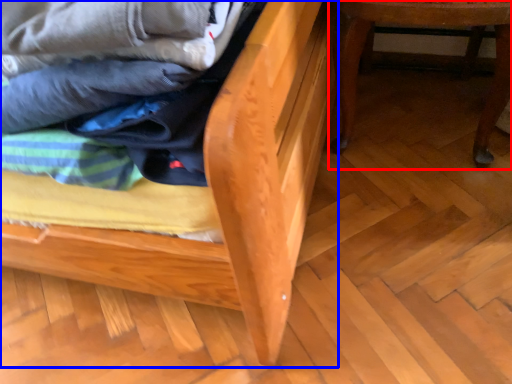
Question: Which object appears closest to the camera in this image, furniture (highlighted by a red box) or furniture (highlighted by a blue box)?

Choices:
 (A) furniture
 (B) furniture

Answer: (B)